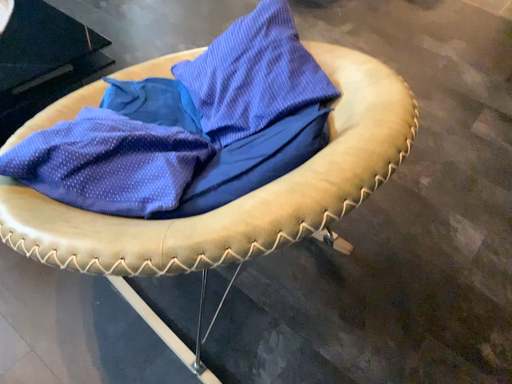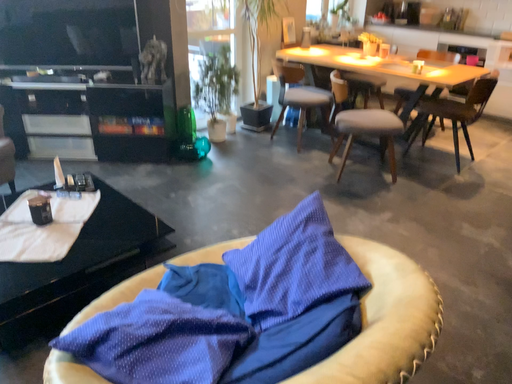
Question: Which way did the camera rotate in the video?

Choices:
 (A) rotated downward
 (B) rotated upward

Answer: (B)